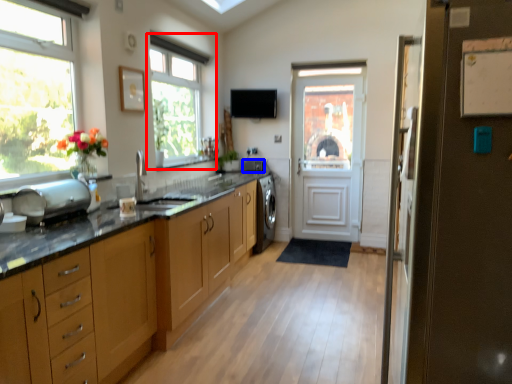
Question: Which object is further to the camera taking this photo, window (highlighted by a red box) or appliance (highlighted by a blue box)?

Choices:
 (A) window
 (B) appliance

Answer: (B)